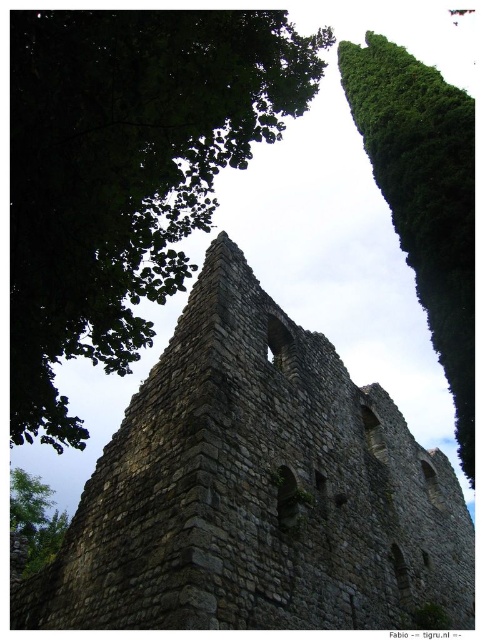
Between green leafy tree at upper left and green leafy tree at upper right, which one is positioned lower?

green leafy tree at upper right is below.

Does green leafy tree at upper left have a lesser width compared to green leafy tree at upper right?

Indeed, green leafy tree at upper left has a lesser width compared to green leafy tree at upper right.

The image size is (485, 640). Identify the location of green leafy tree at upper left. (126, 172).

Can you confirm if green leafy tree at upper right is bigger than green leafy tree at lower left?

Yes.

Which is more to the left, green leafy tree at upper right or green leafy tree at lower left?

From the viewer's perspective, green leafy tree at lower left appears more on the left side.

Who is more forward, (410, 118) or (28, 547)?

Point (410, 118) is in front.

Locate an element on the screen. Image resolution: width=485 pixels, height=640 pixels. green leafy tree at upper right is located at coordinates (424, 196).

Between point (454, 582) and point (393, 198), which one is positioned in front?

Point (393, 198) is more forward.

Where is `stone wall at center`? Image resolution: width=485 pixels, height=640 pixels. stone wall at center is located at coordinates (256, 490).

The height and width of the screenshot is (640, 485). In order to click on stone wall at center in this screenshot , I will do `click(256, 490)`.